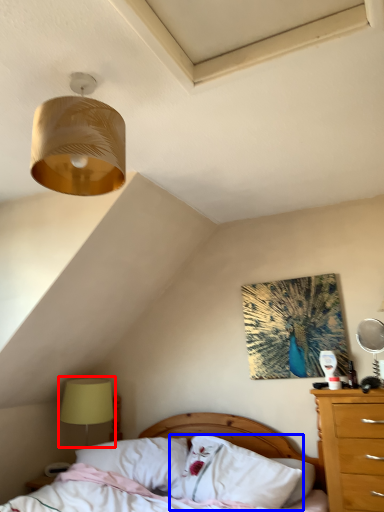
Question: Which of the following is the farthest to the observer, table lamp (highlighted by a red box) or pillow (highlighted by a blue box)?

Choices:
 (A) table lamp
 (B) pillow

Answer: (A)